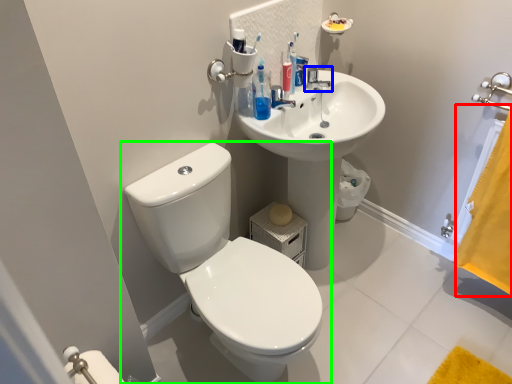
Question: Based on their relative distances, which object is farther from curtain (highlighted by a red box)? Choose from tap (highlighted by a blue box) and toilet (highlighted by a green box).

Choices:
 (A) tap
 (B) toilet

Answer: (B)